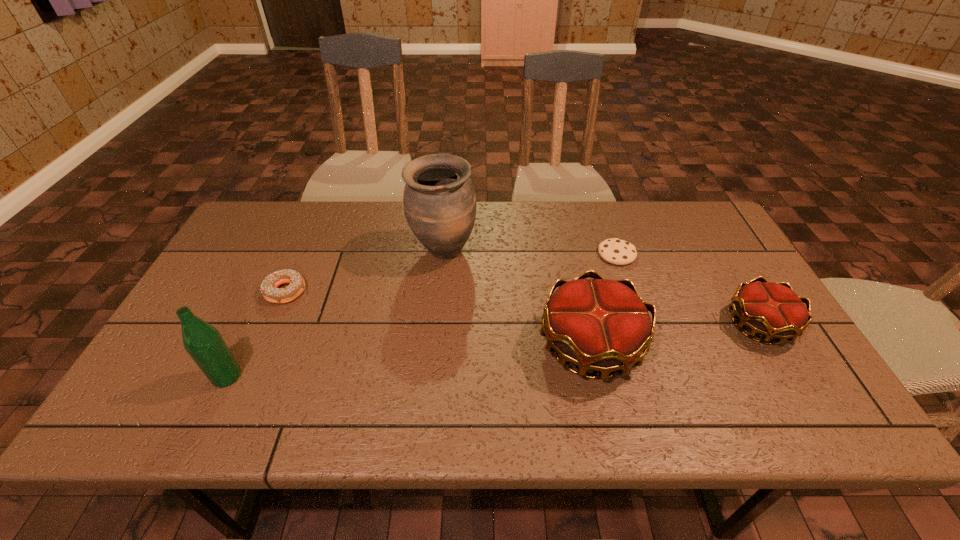
Identify the location of object present at the right edge. Image resolution: width=960 pixels, height=540 pixels. (773, 310).

Where is `object that is positioned at the near left corner`? The height and width of the screenshot is (540, 960). object that is positioned at the near left corner is located at coordinates (203, 342).

This screenshot has width=960, height=540. Identify the location of free spot at the far edge of the desktop. (646, 235).

You are a GUI agent. You are given a task and a screenshot of the screen. Output one action in this format:
    pyautogui.click(x=<x>, y=<y>)
    Task: Click on the free region at the near edge
    The width and height of the screenshot is (960, 540).
    Given the screenshot: What is the action you would take?
    pyautogui.click(x=684, y=379)

Image resolution: width=960 pixels, height=540 pixels. What are the coordinates of `free space at the left edge` in the screenshot? It's located at (212, 286).

This screenshot has width=960, height=540. I want to click on free region at the far left corner of the desktop, so click(x=283, y=245).

The width and height of the screenshot is (960, 540). In the image, there is a desktop. Identify the location of free space at the far right corner. (715, 236).

The height and width of the screenshot is (540, 960). Identify the location of free space at the near right corner of the desktop. (769, 388).

Find the location of `vacant space in between the cookie and the doughnut`. vacant space in between the cookie and the doughnut is located at coordinates (451, 273).

Find the location of a particular element. vacant area between the doughnut and the urn is located at coordinates (365, 271).